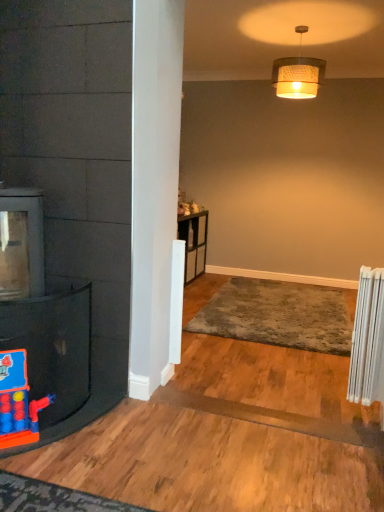
This screenshot has height=512, width=384. Identify the location of free space above woven fabric lampshade at upper center (from a real-world perspective). click(x=312, y=21).